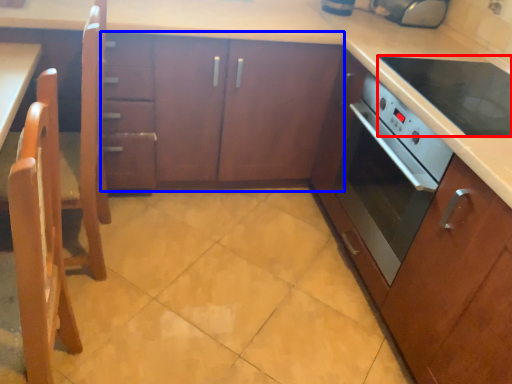
Question: Which object appears closest to the camera in this image, kitchen appliance (highlighted by a red box) or cabinetry (highlighted by a blue box)?

Choices:
 (A) kitchen appliance
 (B) cabinetry

Answer: (A)